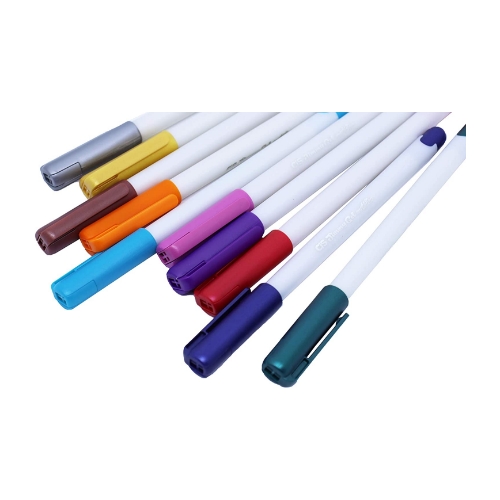
Find the location of a particular element. pen caps is located at coordinates (81, 164), (100, 179), (86, 203), (104, 227), (107, 265), (187, 245), (197, 268), (226, 286), (233, 331), (295, 359).